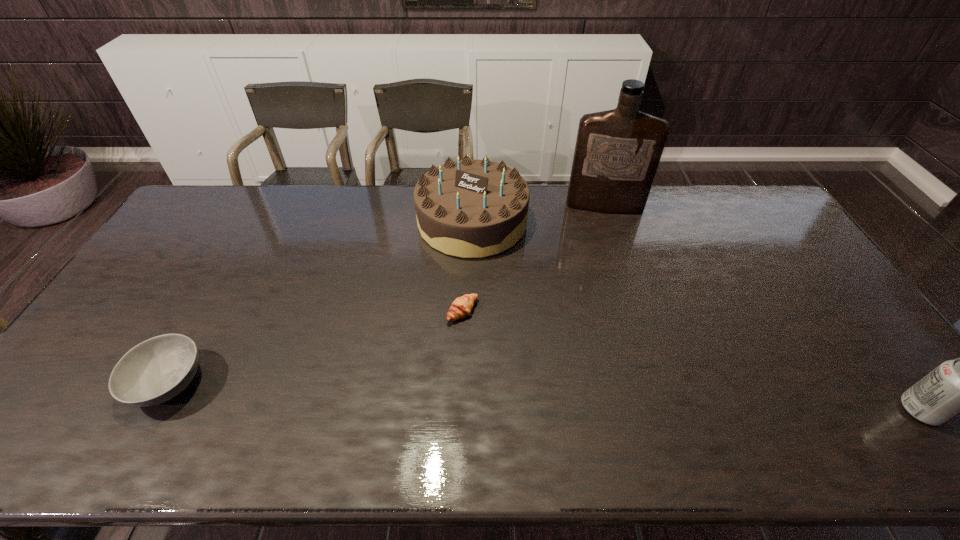
Locate an element on the screen. Image resolution: width=960 pixels, height=540 pixels. liquor present at the far edge is located at coordinates [617, 152].

This screenshot has height=540, width=960. I want to click on birthday cake that is positioned at the far edge, so click(x=469, y=208).

The height and width of the screenshot is (540, 960). I want to click on bowl that is at the near edge, so click(155, 371).

Identify the location of soda can located at the near edge. (959, 386).

What are the coordinates of `object located in the right edge section of the desktop` in the screenshot? It's located at (959, 386).

You are a GUI agent. You are given a task and a screenshot of the screen. Output one action in this format:
    pyautogui.click(x=<x>, y=<y>)
    Task: Click on the object present at the near right corner
    This screenshot has height=540, width=960.
    Given the screenshot: What is the action you would take?
    pyautogui.click(x=959, y=386)

Locate an element on the screen. The image size is (960, 540). free region at the far edge of the desktop is located at coordinates (696, 206).

The image size is (960, 540). In the image, there is a desktop. What are the coordinates of `vacant space at the right edge` in the screenshot? It's located at (781, 238).

Locate an element on the screen. This screenshot has width=960, height=540. vacant space at the far left corner of the desktop is located at coordinates (197, 217).

This screenshot has width=960, height=540. I want to click on vacant space at the near left corner, so click(90, 402).